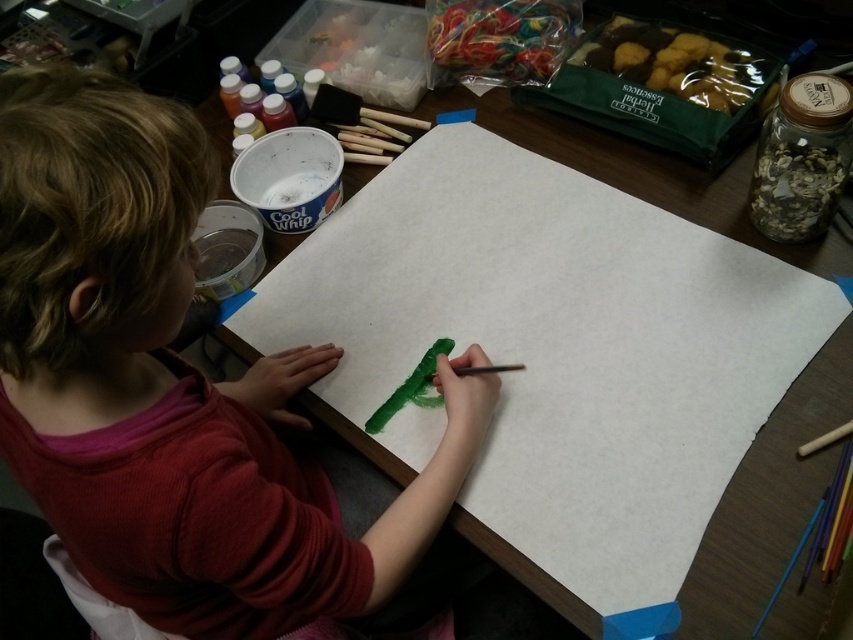
Is multicolored plastic paintbrush at lower right closer to the viewer compared to green matte paint brush at center?

Yes, multicolored plastic paintbrush at lower right is closer to the viewer.

You are a GUI agent. You are given a task and a screenshot of the screen. Output one action in this format:
    pyautogui.click(x=<x>, y=<y>)
    Task: Click on the multicolored plastic paintbrush at lower right
    This screenshot has height=640, width=853.
    Given the screenshot: What is the action you would take?
    pyautogui.click(x=790, y=563)

Which is above, white paper at center or green matte paint brush at center?

white paper at center

Who is more distant from viewer, (523, 436) or (492, 365)?

Positioned behind is point (492, 365).

Where is `white paper at center`? The height and width of the screenshot is (640, 853). white paper at center is located at coordinates (555, 356).

Locate an element on the screen. white paper at center is located at coordinates (555, 356).

You are a GUI agent. You are given a task and a screenshot of the screen. Output one action in this format:
    pyautogui.click(x=<x>, y=<y>)
    Task: Click on the smooth red shirt at center
    
    Given the screenshot: What is the action you would take?
    pyautogui.click(x=178, y=392)

Between smooth red shirt at center and green matte paint brush at center, which one has more height?

smooth red shirt at center is taller.

Does point (215, 544) come behind point (463, 372)?

That is False.

Identify the location of smooth red shirt at center. Image resolution: width=853 pixels, height=640 pixels. (178, 392).